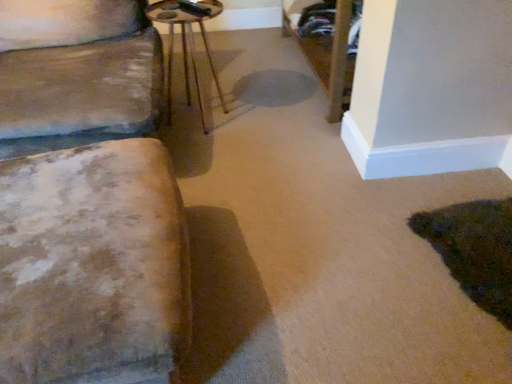
Where is `spots to the right of metallic brown side table at center`? The image size is (512, 384). spots to the right of metallic brown side table at center is located at coordinates (261, 119).